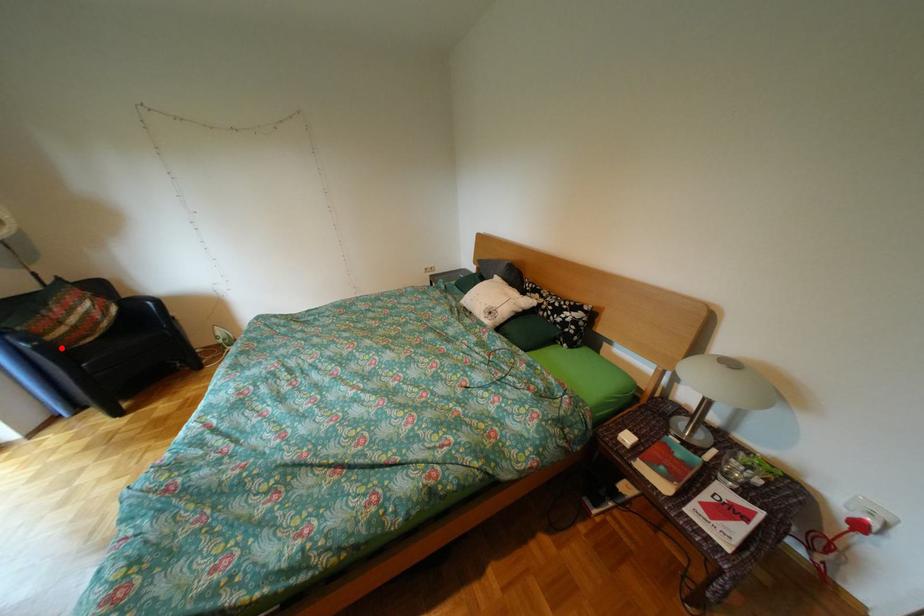
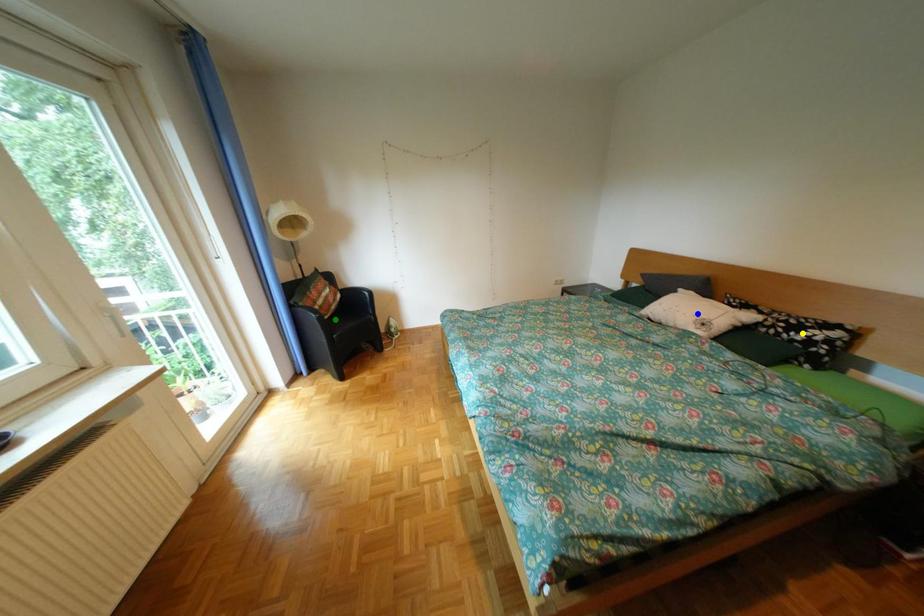
Question: I am providing you with two images of the same scene from different viewpoints. A red point is marked on the first image. You are given multiple points on the second image. In image 2, which mark is for the same physical point as the one in image 1?

Choices:
 (A) yellow point
 (B) green point
 (C) blue point

Answer: (B)